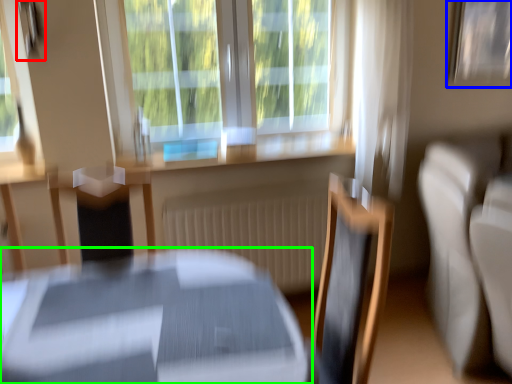
Question: Considering the real-world distances, which object is farthest from picture frame (highlighted by a red box)? picture frame (highlighted by a blue box) or table (highlighted by a green box)?

Choices:
 (A) picture frame
 (B) table

Answer: (A)